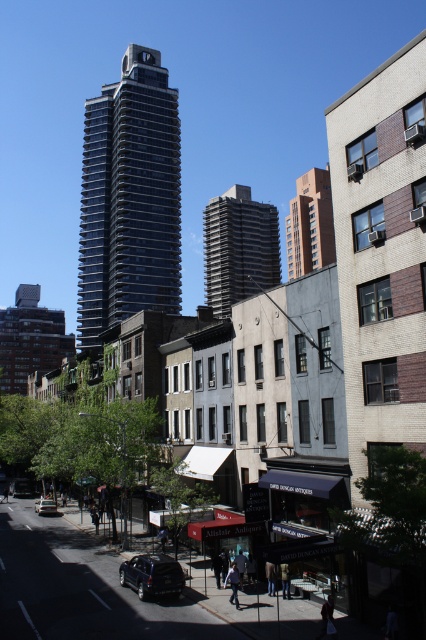
Question: Based on their relative distances, which object is nearer to the burgundy brick building at upper center?

Choices:
 (A) shiny glass building at center
 (B) shiny black suv at lower left
 (C) metallic silver car at lower left

Answer: (A)

Question: Is shiny glass building at center to the right of dark gray concrete building at center from the viewer's perspective?

Choices:
 (A) no
 (B) yes

Answer: (A)

Question: Is burgundy brick building at upper center in front of metallic silver car at lower left?

Choices:
 (A) yes
 (B) no

Answer: (B)

Question: Estimate the real-world distances between objects in this image. Which object is farther from the metallic silver car at lower left?

Choices:
 (A) shiny glass building at center
 (B) dark gray concrete building at center
 (C) shiny black suv at lower left
 (D) burgundy brick building at upper center

Answer: (D)

Question: Can you confirm if dark gray concrete building at center is smaller than shiny black suv at lower left?

Choices:
 (A) no
 (B) yes

Answer: (A)

Question: Among these points, which one is farthest from the camera?

Choices:
 (A) (301, 262)
 (B) (95, 157)

Answer: (A)